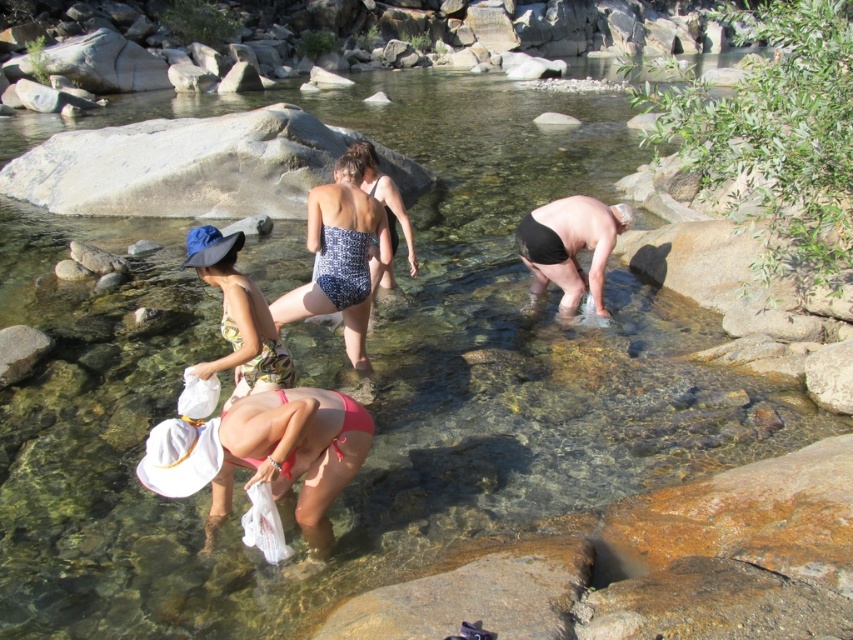
Question: Estimate the real-world distances between objects in this image. Which object is farther from the pink fabric bikini at lower center?

Choices:
 (A) black matte shorts at center
 (B) patterned fabric swimsuit at center

Answer: (A)

Question: Is pink fabric bikini at lower center thinner than black matte shorts at center?

Choices:
 (A) no
 (B) yes

Answer: (A)

Question: Which of the following is the closest to the observer?

Choices:
 (A) (234, 259)
 (B) (325, 307)
 (C) (300, 504)

Answer: (C)

Question: Considering the real-world distances, which object is farthest from the black matte shorts at center?

Choices:
 (A) smooth gray rock at lower left
 (B) printed fabric swimsuit at center
 (C) patterned fabric swimsuit at center
 (D) pink fabric bikini at lower center

Answer: (A)

Question: Does printed fabric swimsuit at center have a larger size compared to smooth gray rock at lower left?

Choices:
 (A) no
 (B) yes

Answer: (B)

Question: Where is patterned fabric swimsuit at center located in relation to black matte shorts at center in the image?

Choices:
 (A) below
 (B) above

Answer: (A)